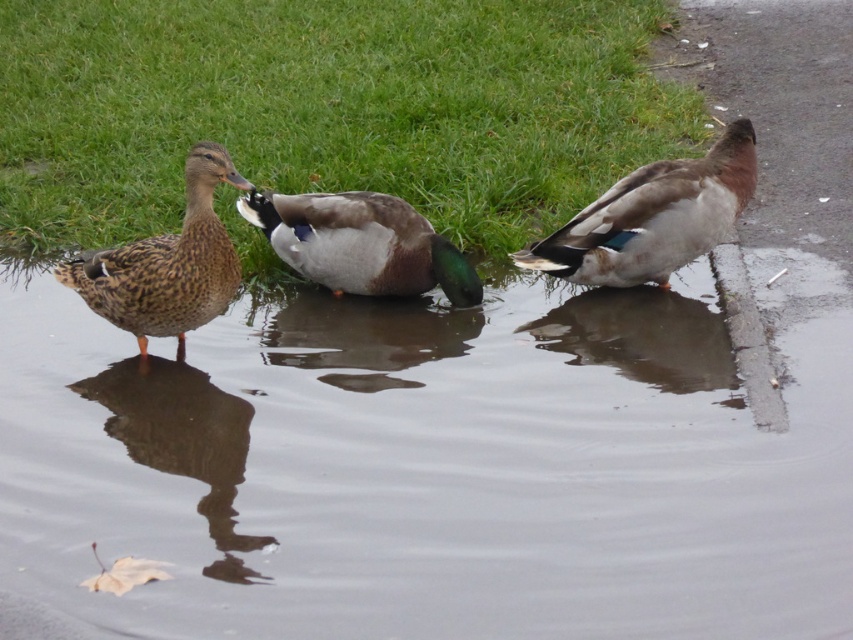
Is transparent water at center above green grass at upper center?

Actually, transparent water at center is below green grass at upper center.

Can you confirm if transparent water at center is positioned to the right of green grass at upper center?

In fact, transparent water at center is to the left of green grass at upper center.

Is point (659, 477) closer to camera compared to point (73, 13)?

Yes, it is in front of point (73, 13).

Where is `transparent water at center`? Image resolution: width=853 pixels, height=640 pixels. transparent water at center is located at coordinates (427, 467).

Who is shorter, transparent water at center or smooth concrete curb at right?

smooth concrete curb at right is shorter.

Does transparent water at center appear on the left side of smooth concrete curb at right?

Yes, transparent water at center is to the left of smooth concrete curb at right.

Does point (509, 513) lie behind point (734, 332)?

No, (509, 513) is in front of (734, 332).

The height and width of the screenshot is (640, 853). In order to click on transparent water at center in this screenshot , I will do `click(427, 467)`.

Is green grass at upper center taller than brown speckled duck at left?

In fact, green grass at upper center may be shorter than brown speckled duck at left.

Consider the image. Which is below, green grass at upper center or brown speckled duck at left?

brown speckled duck at left

Does point (25, 140) come closer to viewer compared to point (202, 282)?

That is False.

Locate an element on the screen. green grass at upper center is located at coordinates (328, 109).